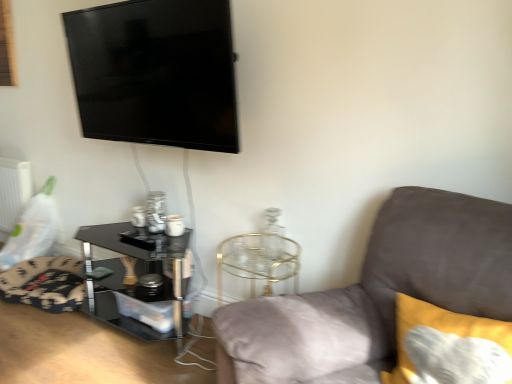
Question: In terms of width, does floral fabric swivel chair at lower left look wider or thinner when compared to white matte radiator at left?

Choices:
 (A) thin
 (B) wide

Answer: (B)

Question: Is point (65, 284) closer or farther from the camera than point (7, 208)?

Choices:
 (A) closer
 (B) farther

Answer: (A)

Question: Which object is the closest to the white matte radiator at left?

Choices:
 (A) soft yellow cushion at right
 (B) black glossy tv at upper left
 (C) suede gray couch at right
 (D) floral fabric swivel chair at lower left
 (E) black glass table at lower left

Answer: (D)

Question: Which object is positioned farthest from the white matte radiator at left?

Choices:
 (A) soft yellow cushion at right
 (B) suede gray couch at right
 (C) black glossy tv at upper left
 (D) black glass table at lower left
 (E) floral fabric swivel chair at lower left

Answer: (A)